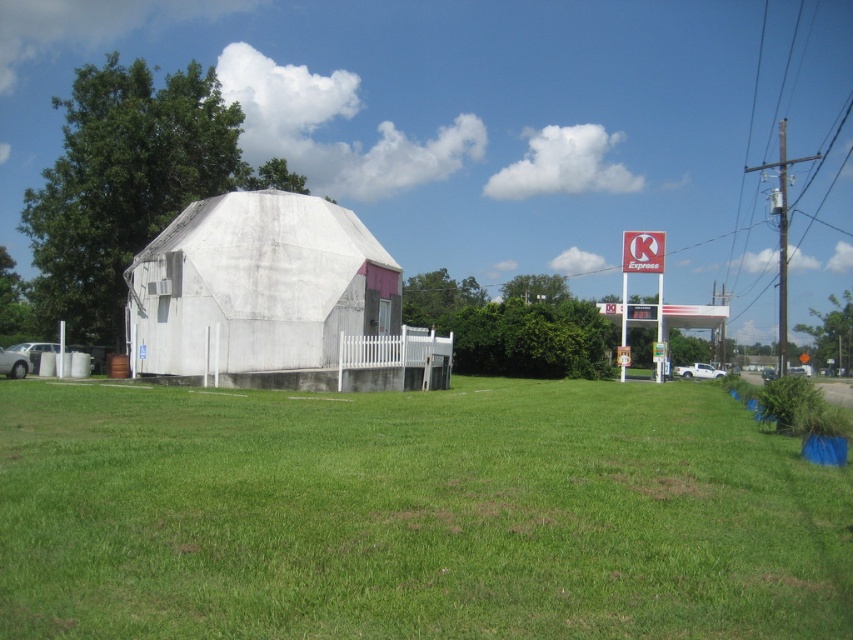
Who is more distant from viewer, [45,385] or [149,352]?

Point [149,352]

Between point (660, 388) and point (247, 234), which one is positioned in front?

Point (247, 234) is more forward.

You are a GUI agent. You are given a task and a screenshot of the screen. Output one action in this format:
    pyautogui.click(x=<x>, y=<y>)
    Task: Click on the green grass at center
    This screenshot has height=640, width=853.
    Given the screenshot: What is the action you would take?
    pyautogui.click(x=413, y=515)